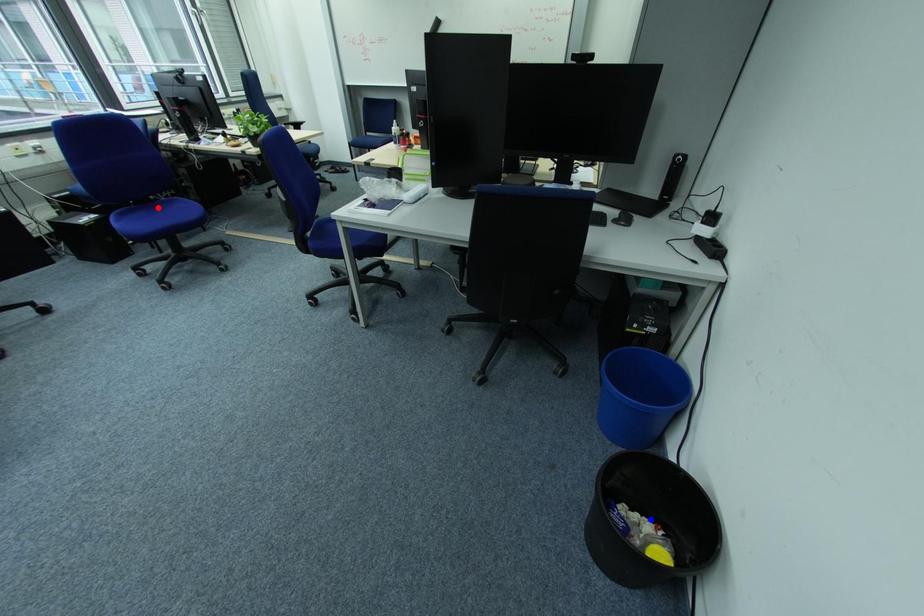
Question: Two points are marked on the image. Which point is closer to the camera?

Choices:
 (A) Blue point is closer.
 (B) Red point is closer.

Answer: (A)